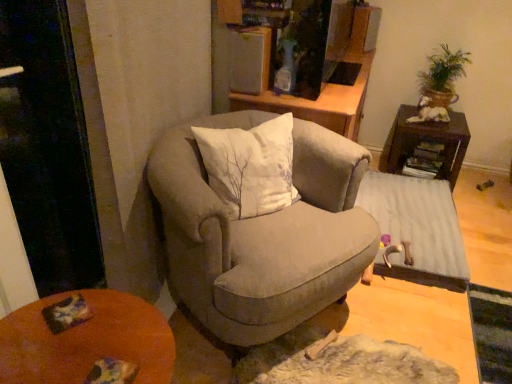
Question: Is velvet beige armchair at center turned away from dark brown wood side table at right, the second table in the bottom-to-top sequence?

Choices:
 (A) no
 (B) yes

Answer: (A)

Question: From a real-world perspective, does velvet beige armchair at center sit lower than dark brown wood side table at right, the 1th table when ordered from top to bottom?

Choices:
 (A) yes
 (B) no

Answer: (B)

Question: Are velvet beige armchair at center and dark brown wood side table at right, the 1th table when ordered from top to bottom, beside each other?

Choices:
 (A) yes
 (B) no

Answer: (B)

Question: Considering the relative sizes of velvet beige armchair at center and dark brown wood side table at right, the second table in the bottom-to-top sequence, in the image provided, is velvet beige armchair at center wider than dark brown wood side table at right, the second table in the bottom-to-top sequence,?

Choices:
 (A) yes
 (B) no

Answer: (A)

Question: Can you confirm if velvet beige armchair at center is bigger than dark brown wood side table at right, the second table in the bottom-to-top sequence?

Choices:
 (A) yes
 (B) no

Answer: (A)

Question: From a real-world perspective, is velvet beige armchair at center positioned over dark brown wood side table at right, the second table in the bottom-to-top sequence, based on gravity?

Choices:
 (A) yes
 (B) no

Answer: (A)

Question: Is orange wooden desk at lower left not close to green leafy plant at upper right?

Choices:
 (A) no
 (B) yes

Answer: (B)

Question: Does orange wooden desk at lower left have a greater width compared to green leafy plant at upper right?

Choices:
 (A) no
 (B) yes

Answer: (B)

Question: Does orange wooden desk at lower left have a smaller size compared to green leafy plant at upper right?

Choices:
 (A) yes
 (B) no

Answer: (B)

Question: From the image's perspective, does orange wooden desk at lower left appear higher than green leafy plant at upper right?

Choices:
 (A) no
 (B) yes

Answer: (A)

Question: Is orange wooden desk at lower left next to green leafy plant at upper right and touching it?

Choices:
 (A) yes
 (B) no

Answer: (B)

Question: Is orange wooden desk at lower left looking in the opposite direction of green leafy plant at upper right?

Choices:
 (A) no
 (B) yes

Answer: (A)

Question: Considering the relative positions of dark brown wood side table at right, the second table in the bottom-to-top sequence, and white ceramic dog at upper right in the image provided, is dark brown wood side table at right, the second table in the bottom-to-top sequence, in front of white ceramic dog at upper right?

Choices:
 (A) no
 (B) yes

Answer: (B)